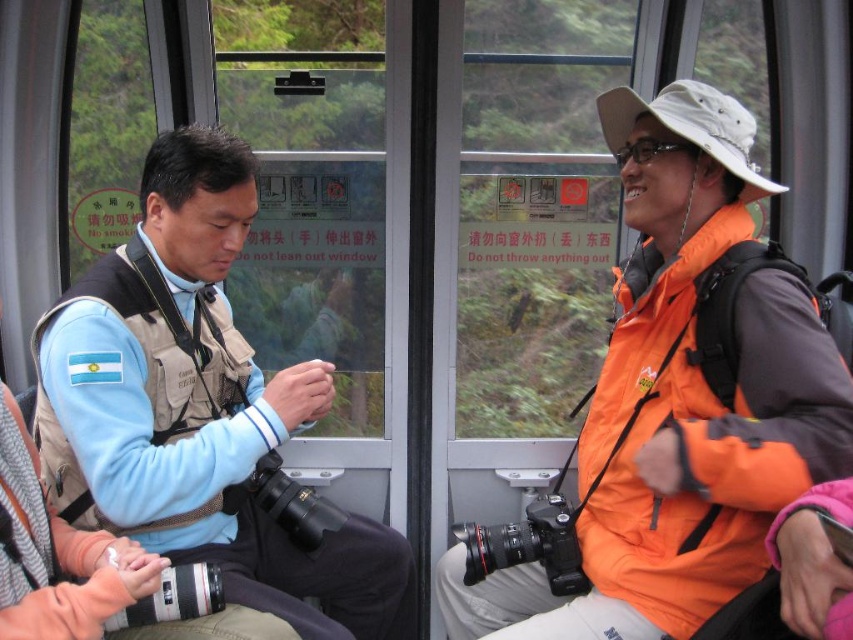
What is the coordinate of the orange matte jacket at right?

The orange matte jacket at right is located at coordinate point (679, 401).

You are a traveler planning to take a cold mountain cable car ride. You see two jackets available for purchase in the gift shop. The orange matte jacket at right and the light blue fabric jacket at left. Which jacket would you choose for better warmth based on their thickness?

The light blue fabric jacket at left is thicker than the orange matte jacket at right, so you should choose the light blue fabric jacket at left for better warmth.

You are a tour guide leading a group in a cable car. You need to ensure that all passengers are within the safety zone marked on the floor, which has a radius of 1.5 meters. The safety zone is centered at the camera. Are both the orange matte jacket at right and the camera within the safety zone?

The orange matte jacket at right and the camera are 1.34 meters apart. Since the safety zone has a radius of 1.5 meters and is centered at the camera, the orange matte jacket at right is within the 1.5 meter radius. Both the orange matte jacket at right and the camera are within the safety zone.